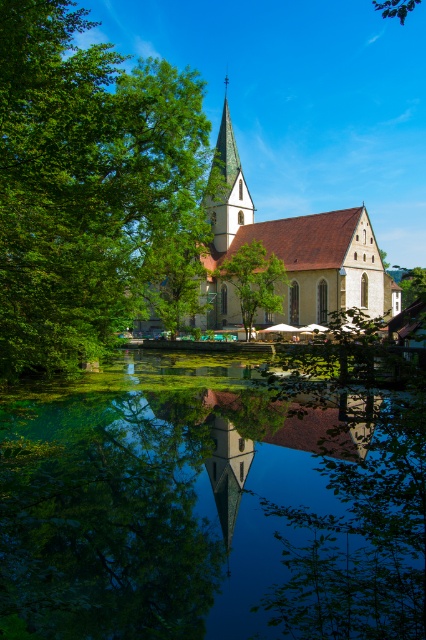
Image resolution: width=426 pixels, height=640 pixels. I want to click on light brown stone church at center, so click(x=293, y=252).

Who is more forward, [190,320] or [264,259]?

Positioned in front is point [264,259].

The height and width of the screenshot is (640, 426). In order to click on light brown stone church at center in this screenshot , I will do `click(293, 252)`.

Does green reflective water at center appear under green leafy tree at left?

Yes, green reflective water at center is below green leafy tree at left.

Is the position of green reflective water at center more distant than that of green leafy tree at left?

No.

Is point (132, 380) farther from viewer compared to point (11, 81)?

Yes.

Find the location of a particular element. green reflective water at center is located at coordinates (215, 499).

Which is behind, point (184, 499) or point (279, 275)?

Point (279, 275)

Measure the distance between point (273, 600) and camera.

Point (273, 600) and camera are 31.66 feet apart.

Locate an element on the screen. This screenshot has width=426, height=640. green reflective water at center is located at coordinates (215, 499).

This screenshot has height=640, width=426. Identify the location of green reflective water at center. (215, 499).